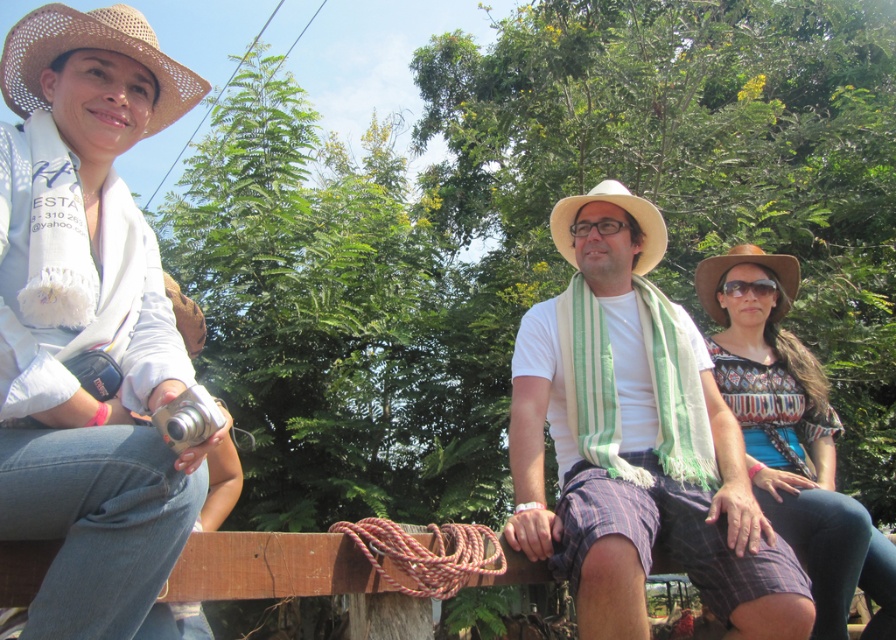
Question: Which object is closer to the camera taking this photo?

Choices:
 (A) white straw hat at center
 (B) brown straw hat at right

Answer: (A)

Question: Observing the image, what is the correct spatial positioning of white woven hat at upper left in reference to black plastic goggles at center?

Choices:
 (A) right
 (B) left

Answer: (B)

Question: Which point is farther from the camera taking this photo?

Choices:
 (A) (576, 348)
 (B) (140, 602)

Answer: (A)

Question: Does strawhat at upper left lie in front of brown straw hat at right?

Choices:
 (A) yes
 (B) no

Answer: (A)

Question: Which object is closer to the camera taking this photo?

Choices:
 (A) white woven hat at upper left
 (B) white cotton shirt at center
 (C) patterned fabric shirt at center

Answer: (A)

Question: Is white cotton shirt at center thinner than strawhat at upper left?

Choices:
 (A) yes
 (B) no

Answer: (B)